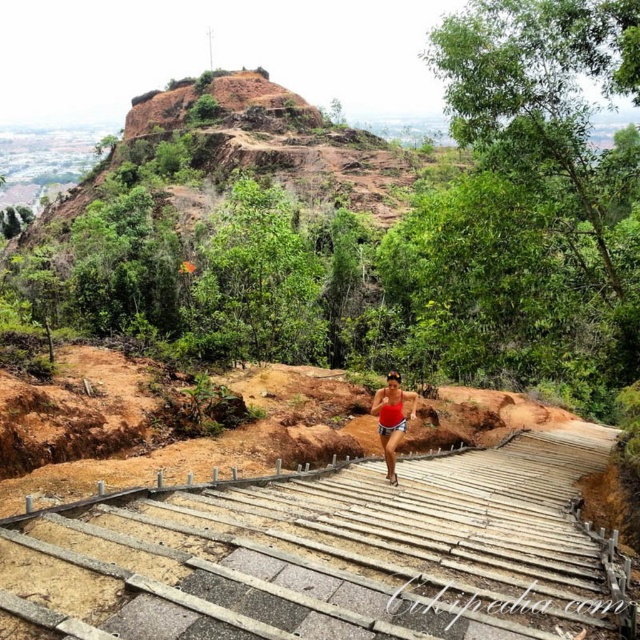
Question: Which of the following is the farthest from the observer?

Choices:
 (A) red matte tank top at center
 (B) wooden stairs at center

Answer: (A)

Question: In this image, where is wooden stairs at center located relative to red matte tank top at center?

Choices:
 (A) left
 (B) right

Answer: (B)

Question: Which object appears farthest from the camera in this image?

Choices:
 (A) wooden stairs at center
 (B) red matte tank top at center

Answer: (B)

Question: Which object is closer to the camera taking this photo?

Choices:
 (A) wooden stairs at center
 (B) red matte tank top at center

Answer: (A)

Question: Can you confirm if wooden stairs at center is thinner than red matte tank top at center?

Choices:
 (A) yes
 (B) no

Answer: (B)

Question: Is wooden stairs at center positioned at the back of red matte tank top at center?

Choices:
 (A) yes
 (B) no

Answer: (B)